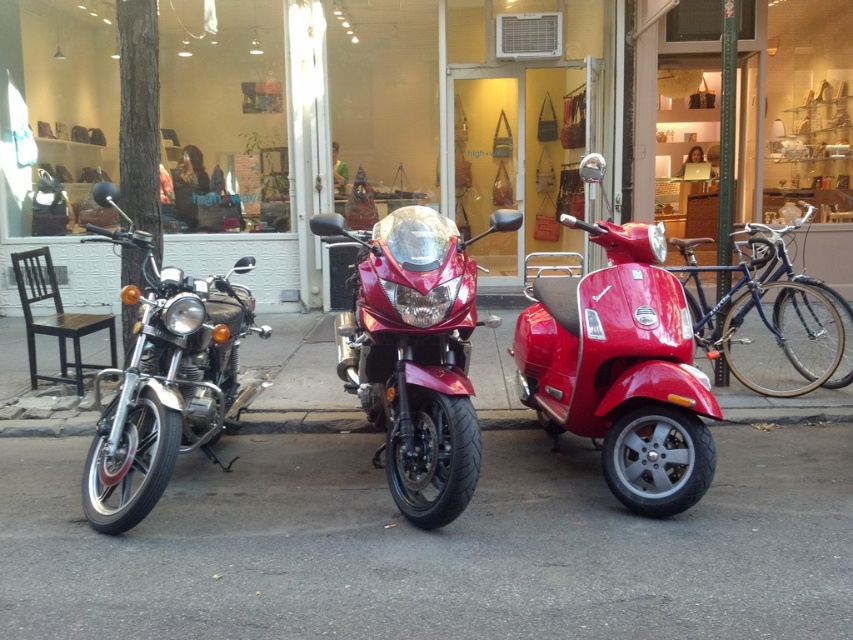
You are a pedestrian standing on the sidewalk across the street from the store. You see the matte black motorcycle at left and the shiny chrome motorcycle at left. Which motorcycle is closer to the store entrance?

The shiny chrome motorcycle at left is closer to the store entrance because it is positioned below the matte black motorcycle at left, meaning it is closer to the ground level where the store entrance is located.

Looking at this image, you are standing at the entrance of the retail store and want to take a photo of the shiny red scooter at center. Where should you position yourself to capture the scooter at the specified coordinates point (621,369)?

The shiny red scooter at center is located at point (621,369), so you should position yourself at the entrance of the retail store and aim your camera towards that coordinate to capture the scooter.

You are standing at the entrance of the retail store and want to place a new sign on the black asphalt at center. According to the scene description, where exactly should the sign be placed?

The black asphalt at center should have the sign placed at point coordinates (434, 547) as specified in the objects description.